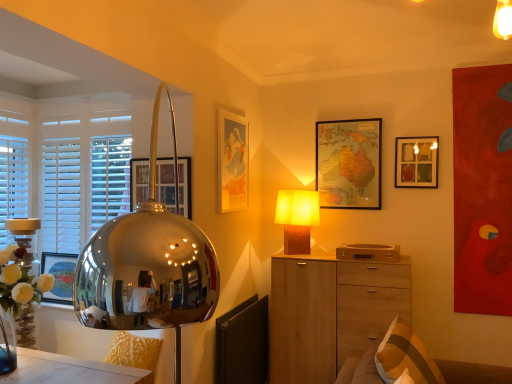
Question: Is wooden chest of drawers at center to the left or to the right of map paper at upper center, which is the 2th picture frame from right to left, in the image?

Choices:
 (A) left
 (B) right

Answer: (A)

Question: Looking at their shapes, would you say wooden chest of drawers at center is wider or thinner than map paper at upper center, which ranks as the 3th picture frame in left-to-right order?

Choices:
 (A) wide
 (B) thin

Answer: (A)

Question: Which object is positioned closest to the white wooden blinds at left?

Choices:
 (A) beige fabric pillow at lower right
 (B) map paper at upper center, which is the 2th picture frame from right to left
 (C) wooden chest of drawers at center
 (D) metallic gold swivel chair at lower left
 (E) matte paper poster at upper center, which ranks as the 2th picture frame in left-to-right order

Answer: (E)

Question: Which is nearer to the matte yellow fabric lampshade at center?

Choices:
 (A) matte paper poster at upper center, which is counted as the 2th picture frame, starting from the front
 (B) map paper at upper center, which appears as the 4th picture frame when viewed from the front
 (C) matte wooden picture frame at upper right, placed as the 1th picture frame when sorted from right to left
 (D) wooden chest of drawers at center
 (E) white wooden blinds at left

Answer: (B)